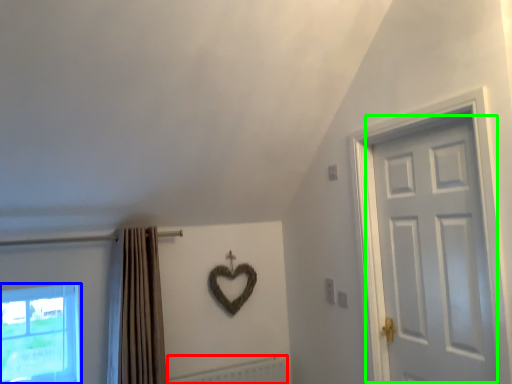
Question: Which is farther away from radiator (highlighted by a red box)? window (highlighted by a blue box) or door (highlighted by a green box)?

Choices:
 (A) window
 (B) door

Answer: (B)